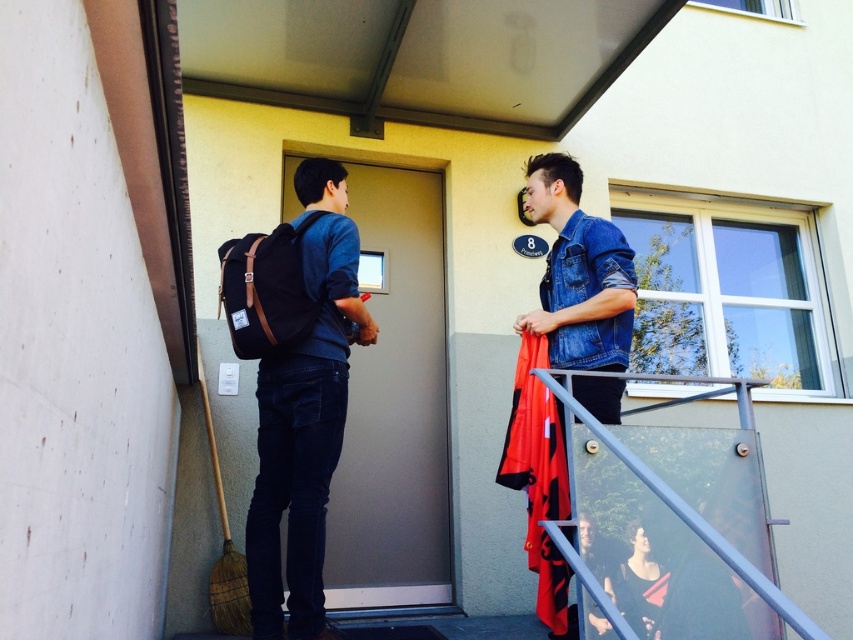
You are a delivery person who needs to place a package between the matte black backpack at left and the denim jacket at upper right. The package is 70 centimeters long. Can you fit it between them?

The distance between the matte black backpack at left and the denim jacket at upper right is 71.75 centimeters, so the 70 centimeter package can fit between them since it is shorter than the available space.

You are a delivery person who needs to place a package between the matte black backpack at left and the denim jacket at upper right. Can you fit the package between them if the package is 1.2 meters wide?

The matte black backpack at left is smaller than the denim jacket at upper right, but the description does not provide specific measurements of their widths or the distance between them. Therefore, it is impossible to determine if the package will fit based on the given information.